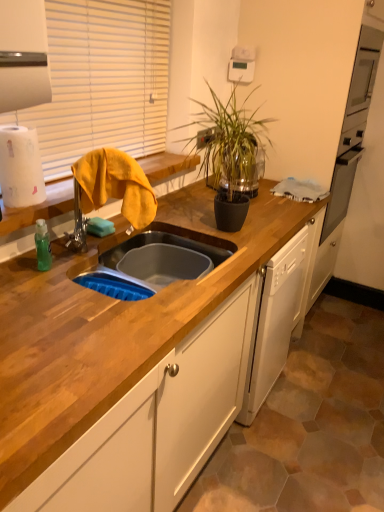
This screenshot has height=512, width=384. I want to click on free space below green glossy plant at center (from a real-world perspective), so click(x=239, y=225).